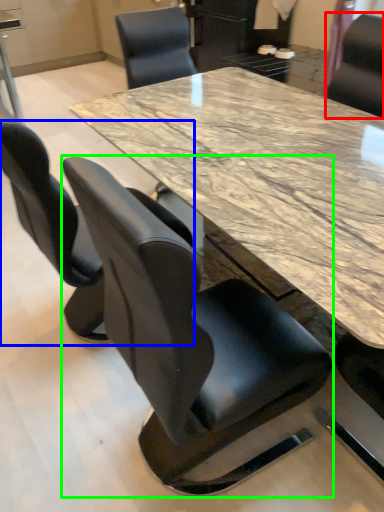
Question: Estimate the real-world distances between objects in this image. Which object is closer to chair (highlighted by a red box), chair (highlighted by a blue box) or chair (highlighted by a green box)?

Choices:
 (A) chair
 (B) chair

Answer: (A)